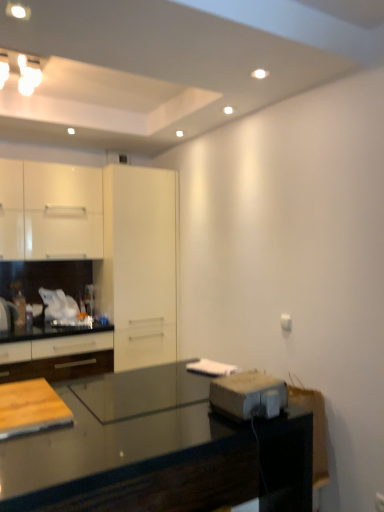
Image resolution: width=384 pixels, height=512 pixels. Find the location of `metallic gray toaster at lower right`. metallic gray toaster at lower right is located at coordinates (248, 395).

Image resolution: width=384 pixels, height=512 pixels. Find the location of `transparent glass cabinet at center`. transparent glass cabinet at center is located at coordinates (140, 264).

Describe the element at coordinates (30, 408) in the screenshot. This screenshot has width=384, height=512. I see `wooden cutting board at lower left` at that location.

What do you see at coordinates (50, 211) in the screenshot? I see `white glossy cabinet at upper left, acting as the second cabinetry starting from the bottom` at bounding box center [50, 211].

You are a GUI agent. You are given a task and a screenshot of the screen. Output one action in this format:
    pyautogui.click(x=<x>, y=<y>)
    Task: Click on the white glossy cabinet at upper left, acting as the second cabinetry starting from the bottom
    Image resolution: width=384 pixels, height=512 pixels.
    Given the screenshot: What is the action you would take?
    pyautogui.click(x=50, y=211)

You are a GUI agent. You are given a task and a screenshot of the screen. Output one action in this format:
    pyautogui.click(x=<x>, y=<y>)
    Task: Click on the white glossy cabinets at left, the second cabinetry in the top-to-bottom sequence
    
    Given the screenshot: What is the action you would take?
    pyautogui.click(x=87, y=265)

Is white glossy cabinet at upper left, acting as the second cabinetry starting from the bottom, turned away from metallic gray toaster at lower right?

white glossy cabinet at upper left, acting as the second cabinetry starting from the bottom, is not turned away from metallic gray toaster at lower right.

In order to click on appliance located in front of the white glossy cabinet at upper left, arranged as the 1th cabinetry when viewed from the top in this screenshot , I will do `click(248, 395)`.

Which is more to the right, wooden cutting board at lower left or metallic gray toaster at lower right?

metallic gray toaster at lower right is more to the right.

Is wooden cutting board at lower left far from metallic gray toaster at lower right?

wooden cutting board at lower left is actually quite close to metallic gray toaster at lower right.

Considering the relative sizes of wooden cutting board at lower left and metallic gray toaster at lower right in the image provided, is wooden cutting board at lower left bigger than metallic gray toaster at lower right?

Indeed, wooden cutting board at lower left has a larger size compared to metallic gray toaster at lower right.

Which point is more forward, (x=10, y=405) or (x=270, y=410)?

Point (x=270, y=410)

Is point (223, 386) closer to camera compared to point (109, 278)?

Yes, point (223, 386) is closer to viewer.

From a real-world perspective, is metallic gray toaster at lower right above or below transparent glass cabinet at center?

In terms of real-world spatial position, metallic gray toaster at lower right is below transparent glass cabinet at center.

Does metallic gray toaster at lower right turn towards transparent glass cabinet at center?

No, metallic gray toaster at lower right is not facing towards transparent glass cabinet at center.

Can wooden cutting board at lower left be found inside transparent glass cabinet at center?

No, transparent glass cabinet at center does not contain wooden cutting board at lower left.

Considering the sizes of objects transparent glass cabinet at center and wooden cutting board at lower left in the image provided, who is wider, transparent glass cabinet at center or wooden cutting board at lower left?

transparent glass cabinet at center.

Is transparent glass cabinet at center bigger than wooden cutting board at lower left?

Yes.

Is transparent glass cabinet at center facing towards wooden cutting board at lower left?

No, transparent glass cabinet at center is not turned towards wooden cutting board at lower left.

Measure the distance from metallic gray toaster at lower right to black glossy countertop at lower center.

The distance of metallic gray toaster at lower right from black glossy countertop at lower center is 27.22 centimeters.

Is metallic gray toaster at lower right positioned with its back to black glossy countertop at lower center?

metallic gray toaster at lower right does not have its back to black glossy countertop at lower center.

Are metallic gray toaster at lower right and black glossy countertop at lower center far apart?

No, metallic gray toaster at lower right is not far from black glossy countertop at lower center.

The height and width of the screenshot is (512, 384). In order to click on the 2nd cabinetry in front when counting from the transparent glass cabinet at center in this screenshot , I will do `click(87, 265)`.

From a real-world perspective, which is physically below, transparent glass cabinet at center or white glossy cabinets at left, the second cabinetry in the top-to-bottom sequence?

transparent glass cabinet at center is physically lower.

From the image's perspective, is transparent glass cabinet at center located above or below white glossy cabinets at left, the second cabinetry in the top-to-bottom sequence?

Based on their image positions, transparent glass cabinet at center is located beneath white glossy cabinets at left, the second cabinetry in the top-to-bottom sequence.

Can you confirm if metallic gray toaster at lower right is positioned to the right of white glossy cabinet at upper left, acting as the second cabinetry starting from the bottom?

Indeed, metallic gray toaster at lower right is positioned on the right side of white glossy cabinet at upper left, acting as the second cabinetry starting from the bottom.

Could you tell me if metallic gray toaster at lower right is facing white glossy cabinet at upper left, acting as the second cabinetry starting from the bottom?

No, metallic gray toaster at lower right is not facing towards white glossy cabinet at upper left, acting as the second cabinetry starting from the bottom.

From a real-world perspective, is metallic gray toaster at lower right located higher than white glossy cabinet at upper left, acting as the second cabinetry starting from the bottom?

No, from a real-world perspective, metallic gray toaster at lower right is not on top of white glossy cabinet at upper left, acting as the second cabinetry starting from the bottom.

Is metallic gray toaster at lower right far from white glossy cabinet at upper left, acting as the second cabinetry starting from the bottom?

Yes.

Locate an element on the screen. This screenshot has height=512, width=384. appliance below the white glossy cabinet at upper left, arranged as the 1th cabinetry when viewed from the top (from the image's perspective) is located at coordinates (248, 395).

You are a GUI agent. You are given a task and a screenshot of the screen. Output one action in this format:
    pyautogui.click(x=<x>, y=<y>)
    Task: Click on the appliance lying behind the wooden cutting board at lower left
    This screenshot has height=512, width=384.
    Given the screenshot: What is the action you would take?
    tap(248, 395)

Based on their spatial positions, is black glossy countertop at lower center or transparent glass cabinet at center further from white glossy cabinet at upper left, arranged as the 1th cabinetry when viewed from the top?

Based on the image, black glossy countertop at lower center appears to be further to white glossy cabinet at upper left, arranged as the 1th cabinetry when viewed from the top.

Based on their spatial positions, is transparent glass cabinet at center or black glossy countertop at lower center closer to white glossy cabinets at left, the 1th cabinetry when ordered from bottom to top?

The object closer to white glossy cabinets at left, the 1th cabinetry when ordered from bottom to top, is transparent glass cabinet at center.

Looking at the image, which one is located further to white glossy cabinets at left, the 1th cabinetry when ordered from bottom to top, wooden cutting board at lower left or metallic gray toaster at lower right?

metallic gray toaster at lower right is positioned further to the anchor white glossy cabinets at left, the 1th cabinetry when ordered from bottom to top.

Estimate the real-world distances between objects in this image. Which object is closer to wooden cutting board at lower left, transparent glass cabinet at center or black glossy countertop at lower center?

black glossy countertop at lower center is positioned closer to the anchor wooden cutting board at lower left.

Estimate the real-world distances between objects in this image. Which object is closer to transparent glass cabinet at center, white glossy cabinets at left, the 1th cabinetry when ordered from bottom to top, or black glossy countertop at lower center?

The object closer to transparent glass cabinet at center is white glossy cabinets at left, the 1th cabinetry when ordered from bottom to top.

When comparing their distances from wooden cutting board at lower left, does white glossy cabinet at upper left, acting as the second cabinetry starting from the bottom, or metallic gray toaster at lower right seem closer?

Among the two, metallic gray toaster at lower right is located nearer to wooden cutting board at lower left.

From the picture: Looking at the image, which one is located closer to black glossy countertop at lower center, white glossy cabinets at left, the 1th cabinetry when ordered from bottom to top, or metallic gray toaster at lower right?

The object closer to black glossy countertop at lower center is metallic gray toaster at lower right.

Estimate the real-world distances between objects in this image. Which object is closer to metallic gray toaster at lower right, white glossy cabinets at left, the second cabinetry in the top-to-bottom sequence, or white glossy cabinet at upper left, arranged as the 1th cabinetry when viewed from the top?

white glossy cabinets at left, the second cabinetry in the top-to-bottom sequence, lies closer to metallic gray toaster at lower right than the other object.

The height and width of the screenshot is (512, 384). What are the coordinates of `countertop between wooden cutting board at lower left and metallic gray toaster at lower right` in the screenshot? It's located at (154, 450).

Identify the location of appliance located between black glossy countertop at lower center and transparent glass cabinet at center in the depth direction. This screenshot has width=384, height=512. (248, 395).

The width and height of the screenshot is (384, 512). Find the location of `appliance between black glossy countertop at lower center and white glossy cabinets at left, the second cabinetry in the top-to-bottom sequence, from front to back`. appliance between black glossy countertop at lower center and white glossy cabinets at left, the second cabinetry in the top-to-bottom sequence, from front to back is located at coordinates pyautogui.click(x=248, y=395).

Identify the location of appliance positioned between black glossy countertop at lower center and white glossy cabinet at upper left, acting as the second cabinetry starting from the bottom, from near to far. (248, 395).